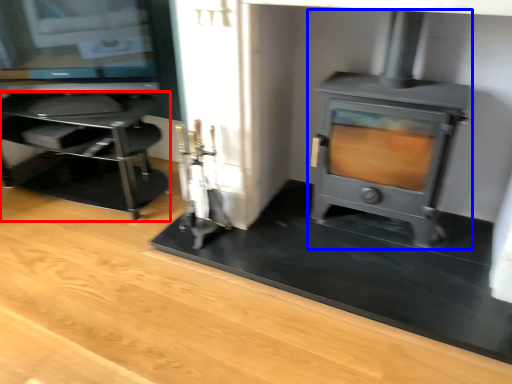
Question: Which point is closer to the camera, furniture (highlighted by a red box) or wood burning stove (highlighted by a blue box)?

Choices:
 (A) furniture
 (B) wood burning stove

Answer: (B)